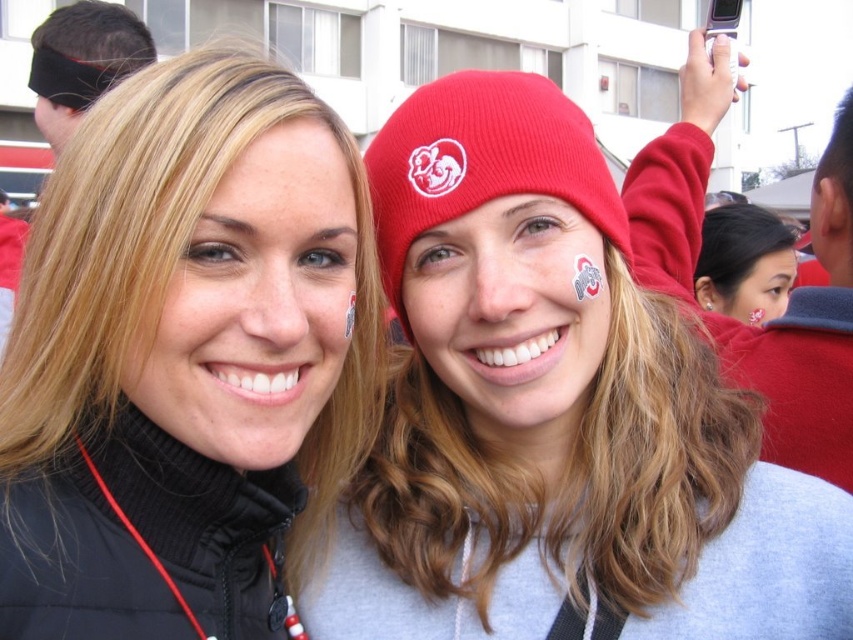
Who is more distant from viewer, (x=462, y=84) or (x=784, y=272)?

Point (x=784, y=272)

Image resolution: width=853 pixels, height=640 pixels. Describe the element at coordinates (482, 161) in the screenshot. I see `red knit beanie at center` at that location.

Does point (376, 168) lie in front of point (720, 312)?

That is True.

Find the location of a particular element. red knit beanie at center is located at coordinates (482, 161).

The image size is (853, 640). I want to click on matte gray hoodie at center, so click(555, 412).

Who is higher up, matte gray hoodie at center or matte red beanie at upper center?

Positioned higher is matte red beanie at upper center.

Who is more distant from viewer, (x=682, y=637) or (x=640, y=236)?

Positioned behind is point (x=640, y=236).

This screenshot has height=640, width=853. I want to click on matte gray hoodie at center, so click(555, 412).

Between black matte jacket at left and black fleece beanie at upper left, which one has less height?

Standing shorter between the two is black fleece beanie at upper left.

Who is higher up, black matte jacket at left or black fleece beanie at upper left?

black fleece beanie at upper left is above.

Between point (231, 148) and point (56, 29), which one is positioned in front?

Point (231, 148)

Where is `black matte jacket at left`? The width and height of the screenshot is (853, 640). black matte jacket at left is located at coordinates (186, 358).